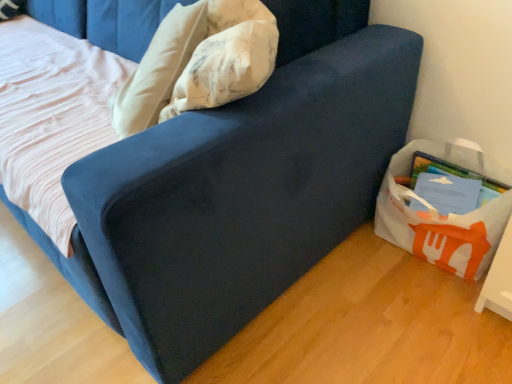
Locate an element on the screen. Image resolution: width=512 pixels, height=384 pixels. white plastic bag at lower right is located at coordinates (443, 216).

Image resolution: width=512 pixels, height=384 pixels. What do you see at coordinates (443, 216) in the screenshot? I see `white plastic bag at lower right` at bounding box center [443, 216].

You are a GUI agent. You are given a task and a screenshot of the screen. Output one action in this format:
    pyautogui.click(x=<x>, y=<y>)
    Task: Click on the white plastic bag at lower right
    
    Given the screenshot: What is the action you would take?
    pyautogui.click(x=443, y=216)